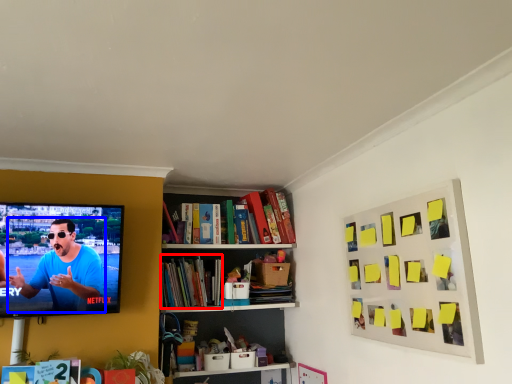
Question: Which object is further to the camera taking this photo, book (highlighted by a red box) or person (highlighted by a blue box)?

Choices:
 (A) book
 (B) person

Answer: (A)